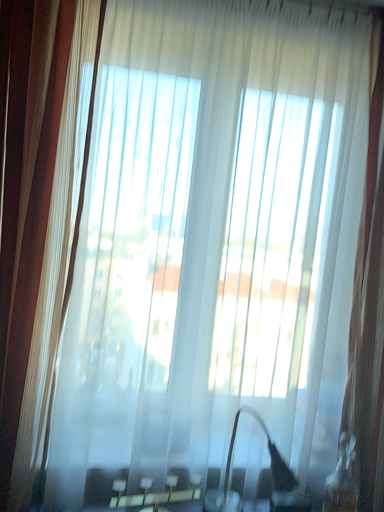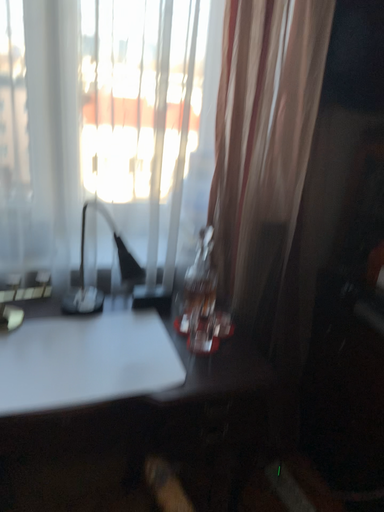
Question: Which way did the camera rotate in the video?

Choices:
 (A) rotated left
 (B) rotated right

Answer: (B)